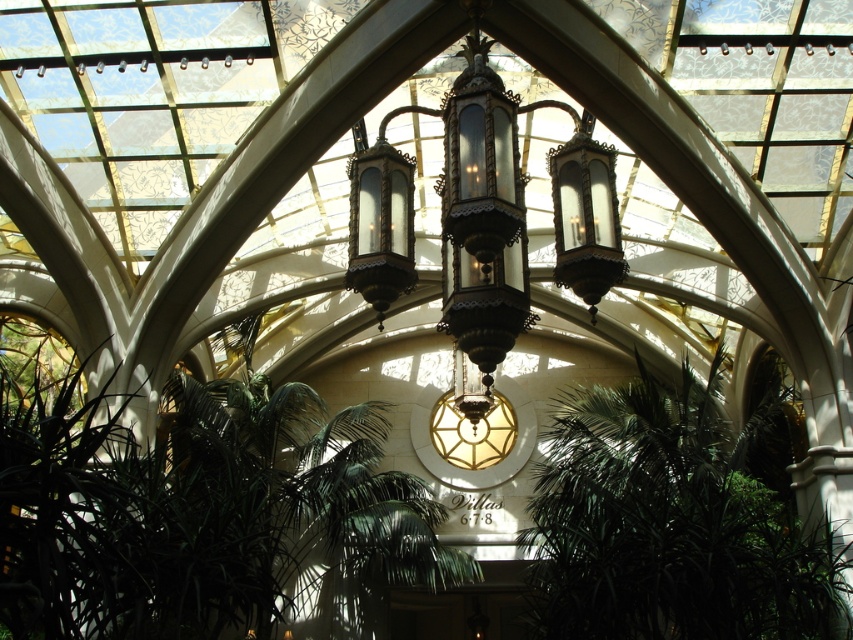
Is green leafy palm tree at center positioned before polished brass chandelier at center?

No, green leafy palm tree at center is behind polished brass chandelier at center.

Which of these two, green leafy palm tree at center or polished brass chandelier at center, stands shorter?

polished brass chandelier at center

Identify the location of green leafy palm tree at center. pos(676,520).

Find the location of `green leafy palm tree at center`. green leafy palm tree at center is located at coordinates (676, 520).